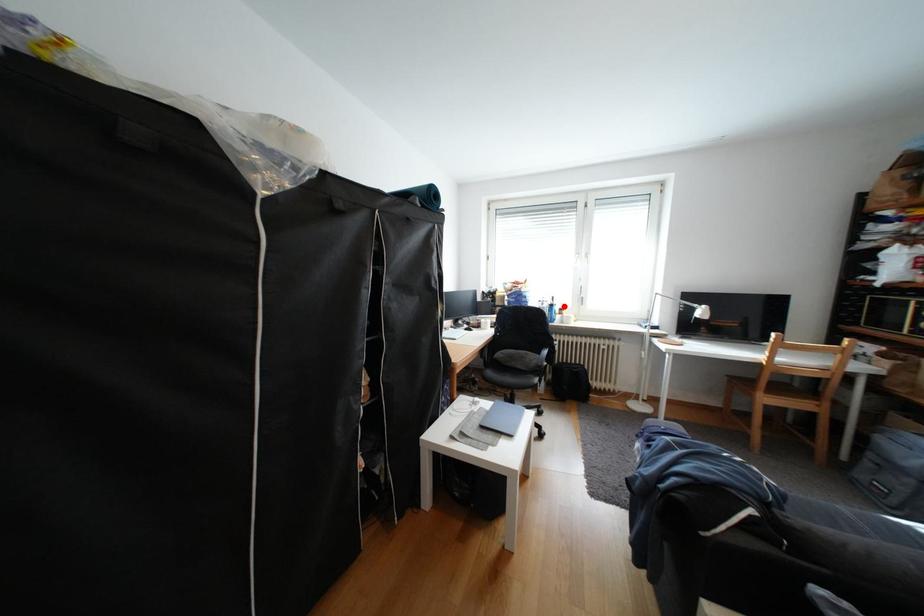
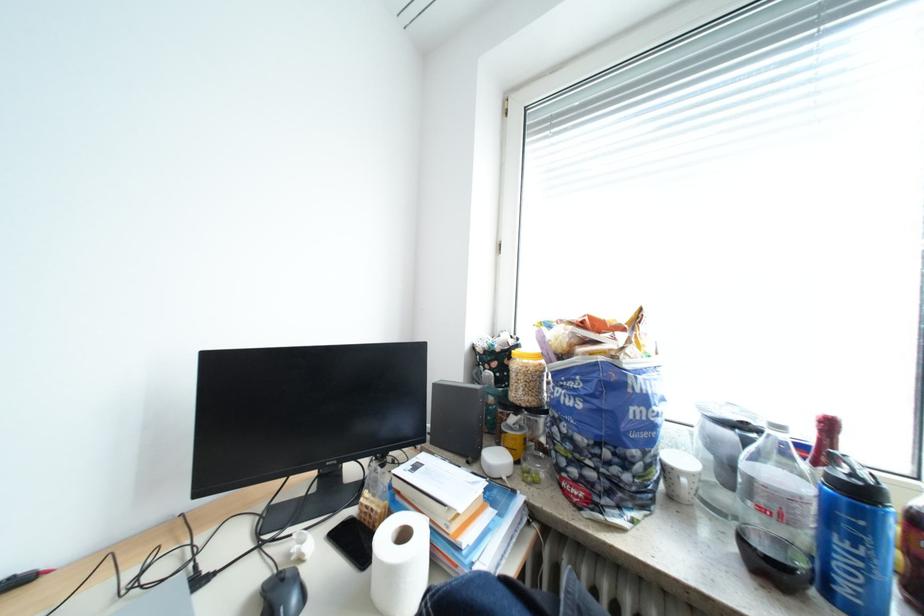
In the second image, find the point that corresponds to the highlighted location in the first image.

(873, 493)